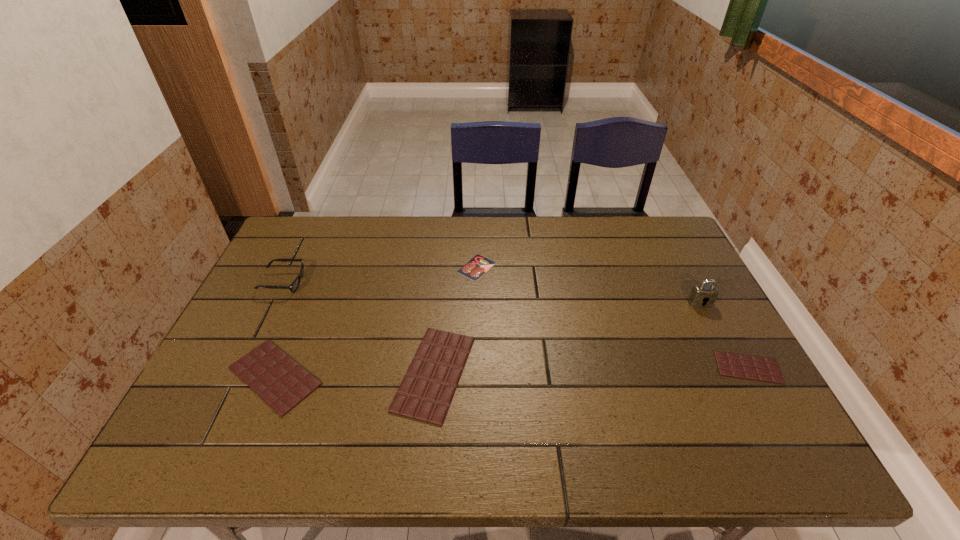
Select which chocolate bar appears as the second closest to the fifth tallest object. Please provide its 2D coordinates. Your answer should be formatted as a tuple, i.e. [(x, y)], where the tuple contains the x and y coordinates of a point satisfying the conditions above.

[(280, 381)]

Find the location of a particular element. The image size is (960, 540). chocolate bar identified as the second closest to the second chocolate bar from right to left is located at coordinates (729, 364).

Locate an element on the screen. The image size is (960, 540). free space in the image that satisfies the following two spatial constraints: 1. on the back side of the rightmost chocolate bar; 2. on the right side of the second shortest chocolate bar is located at coordinates (278, 367).

Image resolution: width=960 pixels, height=540 pixels. Identify the location of free space that satisfies the following two spatial constraints: 1. at the front of the padlock near the keyhole; 2. on the left side of the shortest chocolate bar. (733, 367).

The width and height of the screenshot is (960, 540). I want to click on free space that satisfies the following two spatial constraints: 1. on the front side of the salami; 2. on the front-facing side of the sunglasses, so click(476, 282).

Identify the location of blank area in the image that satisfies the following two spatial constraints: 1. on the back side of the third shortest object; 2. on the front-facing side of the second tallest object. (314, 282).

Find the location of a particular element. Image resolution: width=960 pixels, height=540 pixels. free space that satisfies the following two spatial constraints: 1. at the front of the rightmost chocolate bar near the keyhole; 2. on the left side of the tallest object is located at coordinates (733, 367).

The image size is (960, 540). I want to click on vacant space that satisfies the following two spatial constraints: 1. at the front of the fifth tallest object near the keyhole; 2. on the left side of the padlock, so click(x=733, y=367).

Locate an element on the screen. This screenshot has height=540, width=960. vacant space that satisfies the following two spatial constraints: 1. on the back side of the second shortest object; 2. on the right side of the second chocolate bar from right to left is located at coordinates [435, 367].

In order to click on free spot that satisfies the following two spatial constraints: 1. on the back side of the second shortest chocolate bar; 2. on the right side of the shortest object in this screenshot , I will do `click(320, 267)`.